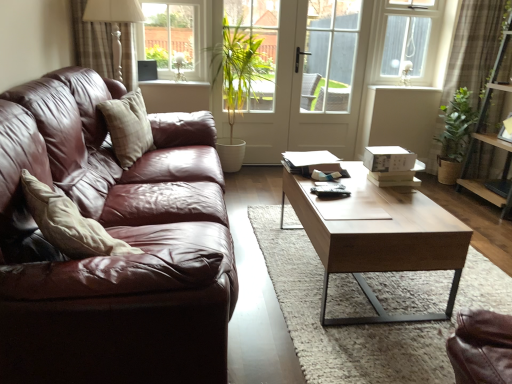
Question: From the image's perspective, is brown textured curtain at upper right, which is counted as the first curtain, starting from the right, above or below clear glass window at upper left, marked as the second window in a right-to-left arrangement?

Choices:
 (A) below
 (B) above

Answer: (A)

Question: Is brown textured curtain at upper right, arranged as the 2th curtain when viewed from the left, inside or outside of clear glass window at upper left, positioned as the first window in left-to-right order?

Choices:
 (A) inside
 (B) outside

Answer: (B)

Question: Considering the real-world distances, which object is farthest from the white glossy window sill at upper center, which is counted as the 1th window sill, starting from the left?

Choices:
 (A) brown textured curtain at upper right, which is counted as the first curtain, starting from the right
 (B) plaid fabric curtain at upper left, placed as the first curtain when sorted from left to right
 (C) leather couch at left
 (D) clear glass window at upper left, marked as the second window in a right-to-left arrangement
 (E) clear glass window at upper right, which is the 1th window from right to left

Answer: (A)

Question: Which object is the farthest from the white glossy window sill at upper center, the 1th window sill positioned from the front?

Choices:
 (A) brown textured curtain at upper right, which is counted as the first curtain, starting from the right
 (B) clear glass window at upper right, which is the second window from left to right
 (C) clear glass window at upper left, marked as the second window in a right-to-left arrangement
 (D) wooden coffee table at center
 (E) leather couch at left

Answer: (A)